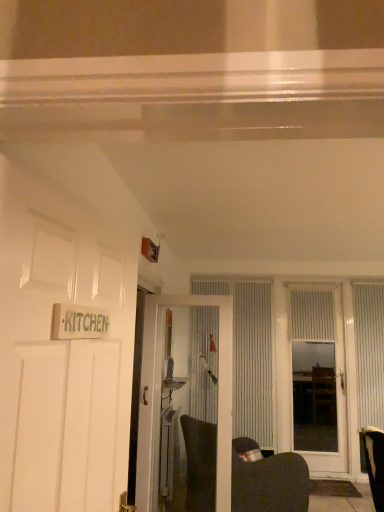
Measure the distance between point (371,325) and camera.

Point (371,325) and camera are 5.17 meters apart from each other.

This screenshot has width=384, height=512. What do you see at coordinates (249, 356) in the screenshot? I see `white textured curtain at center, which ranks as the third curtain in right-to-left order` at bounding box center [249, 356].

Measure the distance between point [249,297] and camera.

5.45 meters.

What do you see at coordinates (62, 352) in the screenshot? I see `white glossy door at left, which is the third door in right-to-left order` at bounding box center [62, 352].

Where is `dark gray fabric swivel chair at lower center`? dark gray fabric swivel chair at lower center is located at coordinates (269, 481).

Does point (188, 455) lie behind point (322, 393)?

No.

From the image's perspective, is dark gray fabric swivel chair at lower center on top of white textured door at center, which appears as the third door when viewed from the front?

No, from the image's perspective, dark gray fabric swivel chair at lower center is not above white textured door at center, which appears as the third door when viewed from the front.

Considering the relative positions of dark gray fabric swivel chair at lower center and white textured door at center, positioned as the first door in right-to-left order, in the image provided, is dark gray fabric swivel chair at lower center to the right of white textured door at center, positioned as the first door in right-to-left order, from the viewer's perspective?

Incorrect, dark gray fabric swivel chair at lower center is not on the right side of white textured door at center, positioned as the first door in right-to-left order.

In terms of size, does dark gray fabric swivel chair at lower center appear bigger or smaller than white textured door at center, which is the 3th door in left-to-right order?

Considering their sizes, dark gray fabric swivel chair at lower center takes up more space than white textured door at center, which is the 3th door in left-to-right order.

Is white textured curtain at upper right, arranged as the 2th curtain when viewed from the left, surrounding white textured door at center, the second door viewed from the front?

No.

Is point (313, 315) farther from viewer compared to point (154, 461)?

That is True.

Measure the distance between white textured curtain at upper right, placed as the 2th curtain when sorted from right to left, and white textured door at center, the second door viewed from the back.

A distance of 7.75 feet exists between white textured curtain at upper right, placed as the 2th curtain when sorted from right to left, and white textured door at center, the second door viewed from the back.

Is white textured curtain at upper right, placed as the 2th curtain when sorted from right to left, taller or shorter than white textured door at center, the 2th door viewed from the right?

Considering their sizes, white textured curtain at upper right, placed as the 2th curtain when sorted from right to left, has less height than white textured door at center, the 2th door viewed from the right.

Is point (98, 398) closer to viewer compared to point (296, 329)?

Yes.

From the picture: Between white glossy door at left, the first door when ordered from left to right, and white textured curtain at upper right, arranged as the 2th curtain when viewed from the left, which one has smaller size?

white textured curtain at upper right, arranged as the 2th curtain when viewed from the left, is smaller.

Does white glossy door at left, which is the third door in right-to-left order, have a greater width compared to white textured curtain at upper right, arranged as the 2th curtain when viewed from the left?

→ Incorrect, the width of white glossy door at left, which is the third door in right-to-left order, does not surpass that of white textured curtain at upper right, arranged as the 2th curtain when viewed from the left.

Looking at this image, is white glossy door at left, the first door when ordered from left to right, to the left of white textured curtain at upper right, arranged as the 2th curtain when viewed from the left, from the viewer's perspective?

Yes, white glossy door at left, the first door when ordered from left to right, is to the left of white textured curtain at upper right, arranged as the 2th curtain when viewed from the left.

Is white textured curtain at center, which ranks as the third curtain in right-to-left order, far from white textured curtain at upper right, arranged as the 2th curtain when viewed from the left?

Actually, white textured curtain at center, which ranks as the third curtain in right-to-left order, and white textured curtain at upper right, arranged as the 2th curtain when viewed from the left, are a little close together.

Is white textured curtain at upper right, placed as the 2th curtain when sorted from right to left, a part of white textured curtain at center, the first curtain in the left-to-right sequence?

No, white textured curtain at upper right, placed as the 2th curtain when sorted from right to left, is not a part of white textured curtain at center, the first curtain in the left-to-right sequence.

Looking at their sizes, would you say white textured curtain at center, the first curtain in the left-to-right sequence, is wider or thinner than white textured curtain at upper right, placed as the 2th curtain when sorted from right to left?

white textured curtain at center, the first curtain in the left-to-right sequence, is thinner than white textured curtain at upper right, placed as the 2th curtain when sorted from right to left.

Can you confirm if white textured curtain at center, the first curtain in the left-to-right sequence, is taller than white textured curtain at upper right, arranged as the 2th curtain when viewed from the left?

Indeed, white textured curtain at center, the first curtain in the left-to-right sequence, has a greater height compared to white textured curtain at upper right, arranged as the 2th curtain when viewed from the left.

Who is bigger, white textured door at center, which is the second door in left-to-right order, or white textured curtain at center, which ranks as the third curtain in right-to-left order?

white textured door at center, which is the second door in left-to-right order.

From a real-world perspective, between white textured door at center, the second door viewed from the back, and white textured curtain at center, which ranks as the third curtain in right-to-left order, who is vertically lower?

From a 3D spatial view, white textured door at center, the second door viewed from the back, is below.

From the image's perspective, is white textured door at center, the 2th door viewed from the right, located above or below white textured curtain at center, which ranks as the third curtain in right-to-left order?

white textured door at center, the 2th door viewed from the right, is above white textured curtain at center, which ranks as the third curtain in right-to-left order.

How distant is white textured door at center, the 2th door viewed from the right, from white textured curtain at center, which ranks as the third curtain in right-to-left order?

white textured door at center, the 2th door viewed from the right, is 6.34 feet away from white textured curtain at center, which ranks as the third curtain in right-to-left order.

Can you see white textured curtain at center, the first curtain in the left-to-right sequence, touching white textured door at center, which appears as the third door when viewed from the front?

white textured curtain at center, the first curtain in the left-to-right sequence, is not next to white textured door at center, which appears as the third door when viewed from the front, and they're not touching.

Identify the location of the 2nd curtain behind the white textured door at center, which is counted as the 1th door, starting from the back. This screenshot has width=384, height=512. pos(249,356).

From the image's perspective, who appears lower, white textured curtain at center, which ranks as the third curtain in right-to-left order, or white textured door at center, which is the 3th door in left-to-right order?

white textured door at center, which is the 3th door in left-to-right order, is shown below in the image.

Is white textured curtain at right, the first curtain in the right-to-left sequence, situated inside white glossy door at left, the 3th door viewed from the back, or outside?

white textured curtain at right, the first curtain in the right-to-left sequence, cannot be found inside white glossy door at left, the 3th door viewed from the back.

Which object is wider, white textured curtain at right, the first curtain in the right-to-left sequence, or white glossy door at left, the first door when ordered from left to right?

Wider between the two is white textured curtain at right, the first curtain in the right-to-left sequence.

From the picture: Is white textured curtain at right, arranged as the third curtain when viewed from the left, positioned behind white glossy door at left, the 3th door viewed from the back?

That is True.

Identify the location of swivel chair in front of the white textured door at center, which is counted as the 1th door, starting from the back. (269, 481).

The height and width of the screenshot is (512, 384). I want to click on the 2nd curtain positioned above the white textured door at center, the second door viewed from the front (from the image's perspective), so click(x=312, y=315).

Looking at this image, based on their spatial positions, is white textured door at center, the second door viewed from the front, or white glossy door at left, which is the third door in right-to-left order, further from white textured curtain at upper right, placed as the 2th curtain when sorted from right to left?

white glossy door at left, which is the third door in right-to-left order.

Estimate the real-world distances between objects in this image. Which object is closer to white textured door at center, which is the 3th door in left-to-right order, white textured door at center, the 2th door viewed from the right, or white textured curtain at center, which ranks as the third curtain in right-to-left order?

Based on the image, white textured curtain at center, which ranks as the third curtain in right-to-left order, appears to be nearer to white textured door at center, which is the 3th door in left-to-right order.

Looking at the image, which one is located closer to dark gray fabric swivel chair at lower center, white textured curtain at center, which ranks as the third curtain in right-to-left order, or white glossy door at left, the 1th door viewed from the front?

white textured curtain at center, which ranks as the third curtain in right-to-left order, lies closer to dark gray fabric swivel chair at lower center than the other object.

From the image, which object appears to be nearer to white textured curtain at upper right, arranged as the 2th curtain when viewed from the left, white textured curtain at center, which ranks as the third curtain in right-to-left order, or white textured door at center, the 2th door viewed from the right?

The object closer to white textured curtain at upper right, arranged as the 2th curtain when viewed from the left, is white textured curtain at center, which ranks as the third curtain in right-to-left order.

When comparing their distances from white textured curtain at upper right, placed as the 2th curtain when sorted from right to left, does white textured door at center, the 2th door viewed from the right, or dark gray fabric swivel chair at lower center seem closer?

dark gray fabric swivel chair at lower center lies closer to white textured curtain at upper right, placed as the 2th curtain when sorted from right to left, than the other object.

Estimate the real-world distances between objects in this image. Which object is further from dark gray fabric swivel chair at lower center, white textured curtain at right, the first curtain in the right-to-left sequence, or white textured curtain at center, the first curtain in the left-to-right sequence?

Based on the image, white textured curtain at right, the first curtain in the right-to-left sequence, appears to be further to dark gray fabric swivel chair at lower center.

Considering their positions, is dark gray fabric swivel chair at lower center positioned further to white textured door at center, the 2th door viewed from the right, than white textured curtain at upper right, placed as the 2th curtain when sorted from right to left?

white textured curtain at upper right, placed as the 2th curtain when sorted from right to left.

From the picture: When comparing their distances from dark gray fabric swivel chair at lower center, does white textured door at center, which appears as the third door when viewed from the front, or white textured door at center, the second door viewed from the back, seem closer?

Among the two, white textured door at center, the second door viewed from the back, is located nearer to dark gray fabric swivel chair at lower center.

At what (x,y) coordinates should I click in order to perform the action: click on door located between white textured curtain at upper right, arranged as the 2th curtain when viewed from the left, and white textured curtain at right, arranged as the third curtain when viewed from the left, in the left-right direction. Please return your answer as a coordinate pair (x, y). The height and width of the screenshot is (512, 384). Looking at the image, I should click on (319, 367).

Where is `door between white textured curtain at center, which ranks as the third curtain in right-to-left order, and white textured curtain at right, arranged as the third curtain when viewed from the left`? door between white textured curtain at center, which ranks as the third curtain in right-to-left order, and white textured curtain at right, arranged as the third curtain when viewed from the left is located at coordinates (319, 367).

I want to click on swivel chair between white glossy door at left, the 1th door viewed from the front, and white textured curtain at center, the first curtain in the left-to-right sequence, from front to back, so click(x=269, y=481).

Find the location of `swivel chair positioned between white textured door at center, the second door viewed from the back, and white textured curtain at center, which ranks as the third curtain in right-to-left order, from near to far`. swivel chair positioned between white textured door at center, the second door viewed from the back, and white textured curtain at center, which ranks as the third curtain in right-to-left order, from near to far is located at coordinates (269, 481).